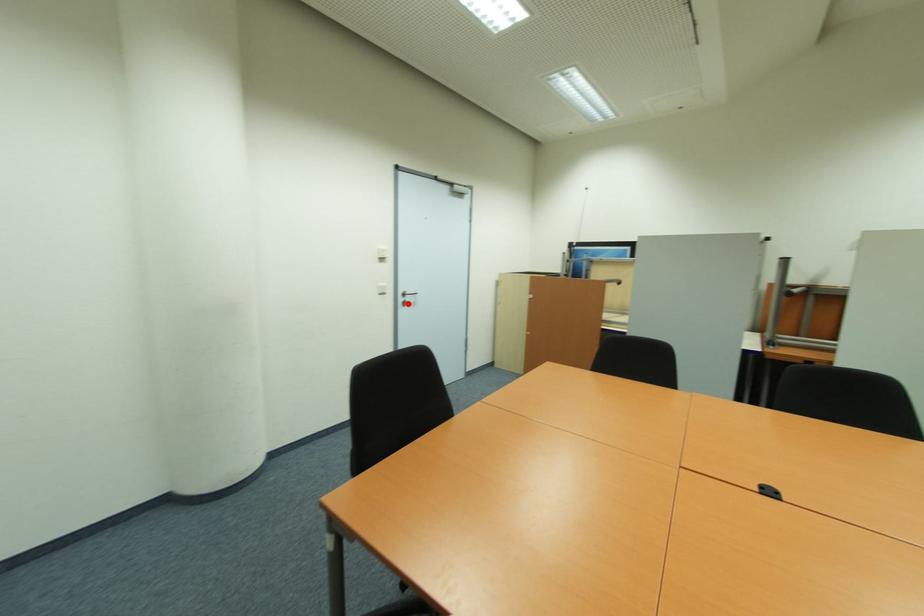
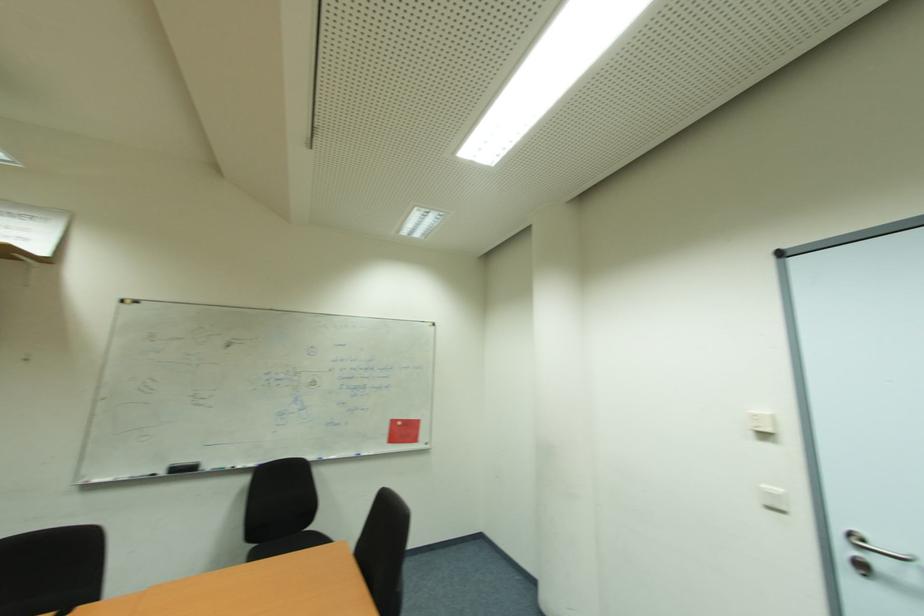
Where in the second image is the point corresponding to the highlighted location from the first image?

(869, 570)